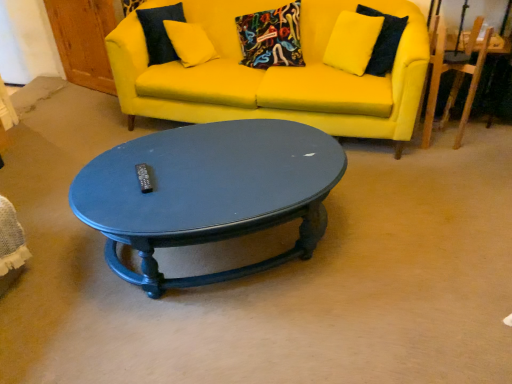
Where is `free space to the left of glossy dark blue coffee table at center`? This screenshot has height=384, width=512. free space to the left of glossy dark blue coffee table at center is located at coordinates (53, 239).